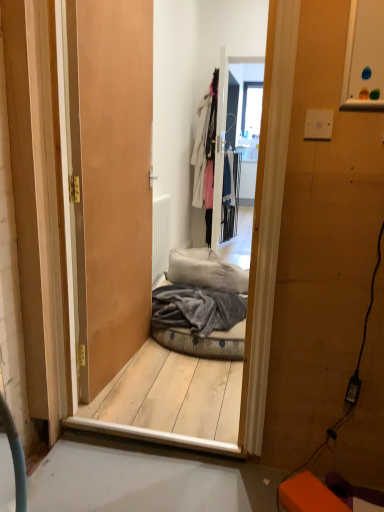
You are a GUI agent. You are given a task and a screenshot of the screen. Output one action in this format:
    pyautogui.click(x=<x>, y=<y>)
    Task: Click on the white cotton coat at upper center
    This screenshot has height=512, width=384.
    Given the screenshot: What is the action you would take?
    pyautogui.click(x=205, y=145)

You are a GUI agent. You are given a task and a screenshot of the screen. Output one action in this format:
    pyautogui.click(x=<x>, y=<y>)
    Task: Click on the gray fleece blanket at center
    
    Given the screenshot: What is the action you would take?
    pyautogui.click(x=196, y=309)

In order to click on wooden door at center in this screenshot , I will do `click(111, 179)`.

Looking at this image, considering the relative positions of white matte radiator at center and transparent glass window at upper center in the image provided, is white matte radiator at center to the left or to the right of transparent glass window at upper center?

In the image, white matte radiator at center appears on the left side of transparent glass window at upper center.

Which of these two, white matte radiator at center or transparent glass window at upper center, stands taller?

transparent glass window at upper center.

In the image, is white matte radiator at center positioned in front of or behind transparent glass window at upper center?

In the image, white matte radiator at center appears in front of transparent glass window at upper center.

Could you tell me if white matte radiator at center is turned towards transparent glass window at upper center?

No, white matte radiator at center is not turned towards transparent glass window at upper center.

Does gray fleece blanket at center turn towards transparent glass window at upper center?

No, gray fleece blanket at center is not aimed at transparent glass window at upper center.

What's the angular difference between gray fleece blanket at center and transparent glass window at upper center's facing directions?

The facing directions of gray fleece blanket at center and transparent glass window at upper center are 2.52 degrees apart.

This screenshot has height=512, width=384. In order to click on material on the left side of transparent glass window at upper center in this screenshot , I will do coord(196,309).

How much distance is there between gray fleece blanket at center and transparent glass window at upper center?

gray fleece blanket at center and transparent glass window at upper center are 2.62 meters apart.

Considering the relative positions of velvet grey pet bed at center and transparent glass window at upper center in the image provided, is velvet grey pet bed at center to the right of transparent glass window at upper center from the viewer's perspective?

In fact, velvet grey pet bed at center is to the left of transparent glass window at upper center.

Which object is thinner, velvet grey pet bed at center or transparent glass window at upper center?

transparent glass window at upper center is thinner.

Is transparent glass window at upper center completely or partially inside velvet grey pet bed at center?

That's incorrect, transparent glass window at upper center is not inside velvet grey pet bed at center.

Would you consider velvet grey pet bed at center to be distant from transparent glass window at upper center?

velvet grey pet bed at center is far away from transparent glass window at upper center.

Is velvet grey pet bed at center not inside white matte radiator at center?

Absolutely, velvet grey pet bed at center is external to white matte radiator at center.

Is velvet grey pet bed at center positioned far away from white matte radiator at center?

velvet grey pet bed at center is actually quite close to white matte radiator at center.

From a real-world perspective, which is physically below, velvet grey pet bed at center or white matte radiator at center?

In real-world perspective, velvet grey pet bed at center is lower.

Can you confirm if velvet grey pet bed at center is smaller than white matte radiator at center?

Actually, velvet grey pet bed at center might be larger than white matte radiator at center.

Considering the sizes of transparent glass window at upper center and white matte radiator at center in the image, is transparent glass window at upper center wider or thinner than white matte radiator at center?

In the image, transparent glass window at upper center appears to be wider than white matte radiator at center.

From the image's perspective, who appears lower, transparent glass window at upper center or white matte radiator at center?

white matte radiator at center is shown below in the image.

Considering the sizes of transparent glass window at upper center and white matte radiator at center in the image, is transparent glass window at upper center taller or shorter than white matte radiator at center?

Clearly, transparent glass window at upper center is taller compared to white matte radiator at center.

How many degrees apart are the facing directions of transparent glass window at upper center and white matte radiator at center?

transparent glass window at upper center and white matte radiator at center are facing 91 degrees away from each other.

Is white cotton coat at upper center next to gray fleece blanket at center?

No, white cotton coat at upper center is not in contact with gray fleece blanket at center.

Based on the photo, is white cotton coat at upper center looking in the opposite direction of gray fleece blanket at center?

No, white cotton coat at upper center is not facing away from gray fleece blanket at center.

Considering the relative sizes of white cotton coat at upper center and gray fleece blanket at center in the image provided, is white cotton coat at upper center taller than gray fleece blanket at center?

Correct, white cotton coat at upper center is much taller as gray fleece blanket at center.

Which is closer to the camera, (206, 94) or (152, 316)?

The point (152, 316) is more forward.

Are wooden door at center and white cotton coat at upper center beside each other?

wooden door at center is not next to white cotton coat at upper center, and they're not touching.

Could you tell me if wooden door at center is facing white cotton coat at upper center?

No, wooden door at center is not turned towards white cotton coat at upper center.

Considering the relative positions of wooden door at center and white cotton coat at upper center in the image provided, is wooden door at center behind white cotton coat at upper center?

No, wooden door at center is in front of white cotton coat at upper center.

In the scene shown: Who is bigger, wooden door at center or white cotton coat at upper center?

white cotton coat at upper center.

Image resolution: width=384 pixels, height=512 pixels. What are the coordinates of `window above the white matte radiator at center (from a real-world perspective)` in the screenshot? It's located at (251, 109).

This screenshot has width=384, height=512. Find the location of `material below the transparent glass window at upper center (from a real-world perspective)`. material below the transparent glass window at upper center (from a real-world perspective) is located at coordinates (196, 309).

When comparing their distances from wooden door at center, does velvet grey pet bed at center or transparent glass window at upper center seem closer?

Based on the image, velvet grey pet bed at center appears to be nearer to wooden door at center.

Which object lies further to the anchor point white cotton coat at upper center, wooden door at center or transparent glass window at upper center?

wooden door at center is further to white cotton coat at upper center.

Considering their positions, is transparent glass window at upper center positioned closer to white cotton coat at upper center than wooden door at center?

transparent glass window at upper center is closer to white cotton coat at upper center.

Estimate the real-world distances between objects in this image. Which object is closer to gray fleece blanket at center, transparent glass window at upper center or wooden door at center?

wooden door at center is closer to gray fleece blanket at center.

Looking at the image, which one is located further to white matte radiator at center, gray fleece blanket at center or transparent glass window at upper center?

transparent glass window at upper center.

From the image, which object appears to be nearer to white matte radiator at center, white cotton coat at upper center or velvet grey pet bed at center?

velvet grey pet bed at center is closer to white matte radiator at center.

Looking at the image, which one is located closer to white matte radiator at center, white cotton coat at upper center or gray fleece blanket at center?

The object closer to white matte radiator at center is gray fleece blanket at center.

Considering their positions, is white cotton coat at upper center positioned further to gray fleece blanket at center than white matte radiator at center?

white cotton coat at upper center is positioned further to the anchor gray fleece blanket at center.

Find the location of a particular element. bed between wooden door at center and transparent glass window at upper center in the front-back direction is located at coordinates (202, 306).

This screenshot has height=512, width=384. What are the coordinates of `material positioned between wooden door at center and transparent glass window at upper center from near to far` in the screenshot? It's located at (196, 309).

Identify the location of clothing between wooden door at center and transparent glass window at upper center in the front-back direction. The image size is (384, 512). (205, 145).

The height and width of the screenshot is (512, 384). Identify the location of bed between gray fleece blanket at center and white matte radiator at center in the front-back direction. (202, 306).